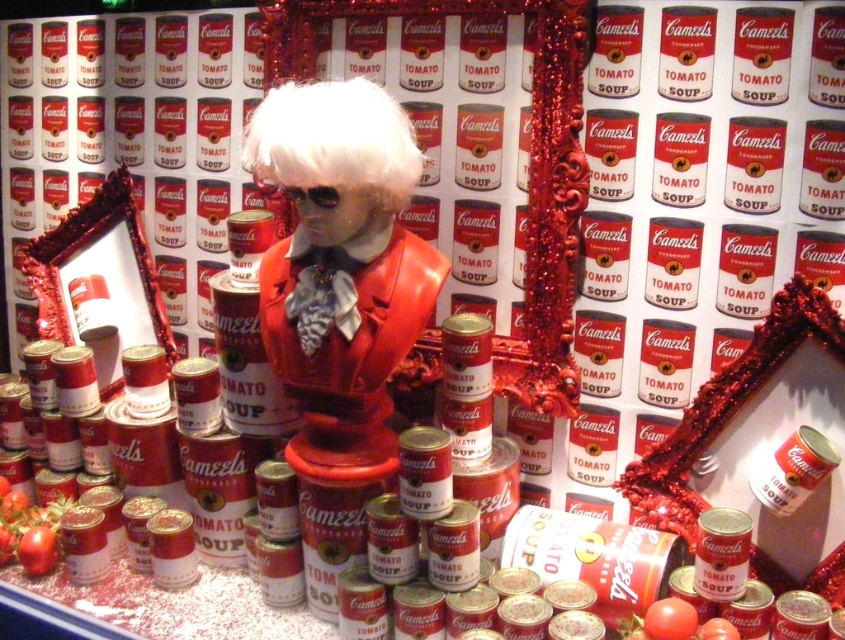
Question: Is shiny plastic bust at center to the right of white matte wig at center from the viewer's perspective?

Choices:
 (A) yes
 (B) no

Answer: (A)

Question: Which point is closer to the camera?

Choices:
 (A) shiny plastic bust at center
 (B) white matte wig at center

Answer: (B)

Question: Which of the following is the farthest from the observer?

Choices:
 (A) white matte wig at center
 (B) shiny plastic bust at center

Answer: (B)

Question: Is shiny plastic bust at center smaller than white matte wig at center?

Choices:
 (A) yes
 (B) no

Answer: (B)

Question: Can you confirm if shiny plastic bust at center is positioned below white matte wig at center?

Choices:
 (A) yes
 (B) no

Answer: (A)